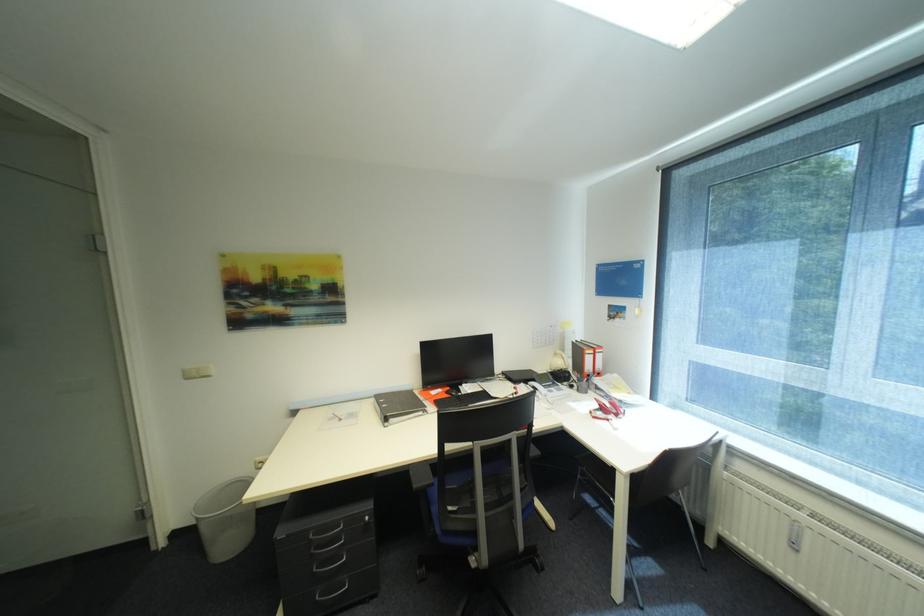
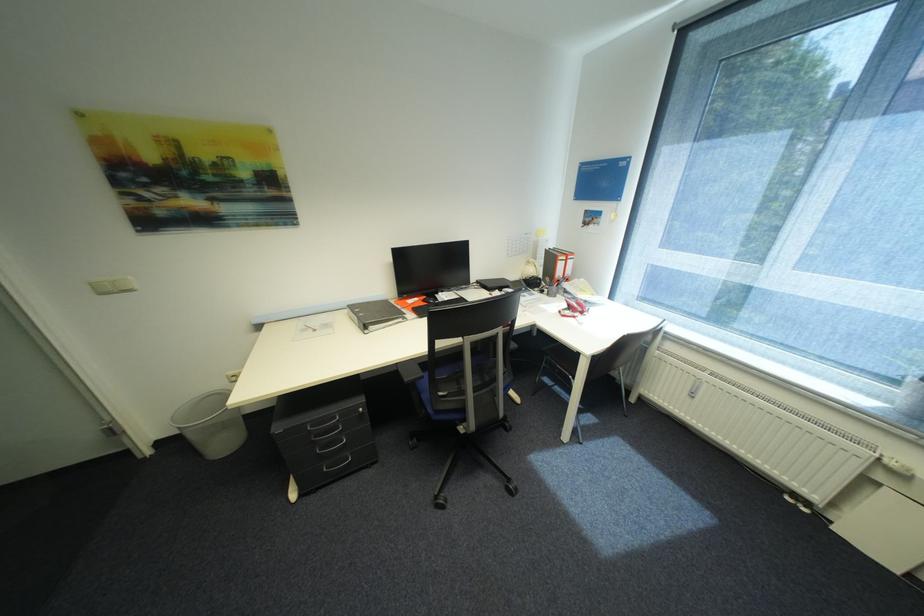
Looking at this image, in a continuous first-person perspective shot, in which direction is the camera moving?

The cameraman moved toward left, forward.